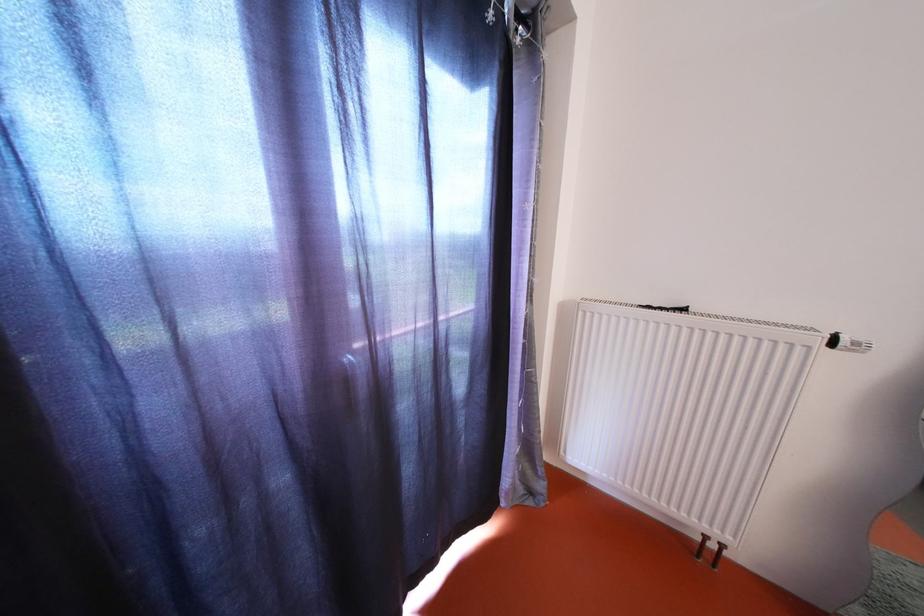
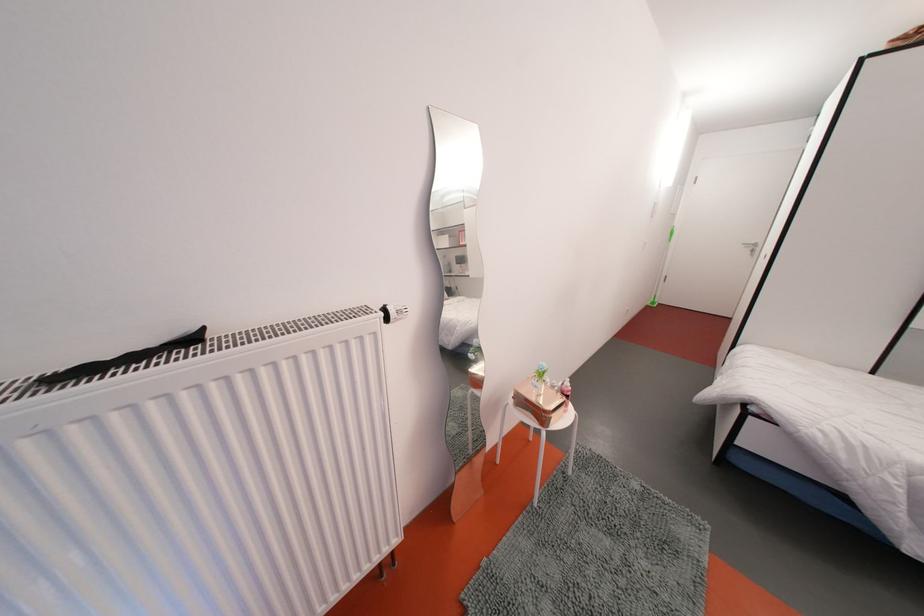
First-person continuous shooting, in which direction is the camera rotating?

The camera rotated toward right-down.